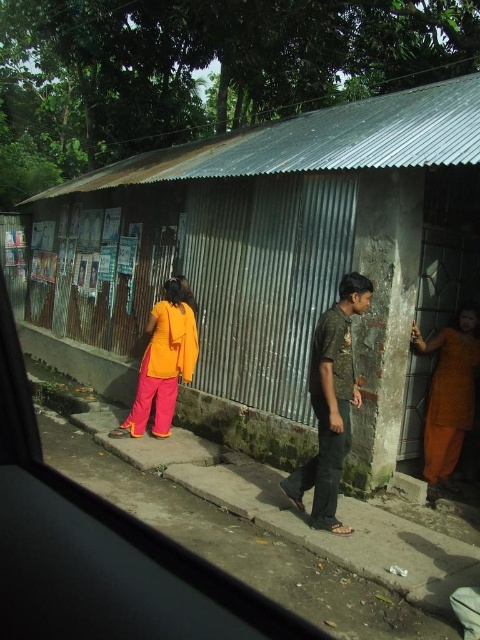
You are a delivery person needing to park your vehicle near the corrugated metal hut at center and the matte orange dress at center. Which location would require more space to accommodate your delivery truck?

The corrugated metal hut at center is bigger than the matte orange dress at center, so parking near the corrugated metal hut at center would require more space.

You are a passenger in a car and see the corrugated metal hut at center and the orange fabric dress at right from the window. Which object is nearer to the car window?

The corrugated metal hut at center is closer to the viewer than the orange fabric dress at right, so the corrugated metal hut at center is nearer to the car window.